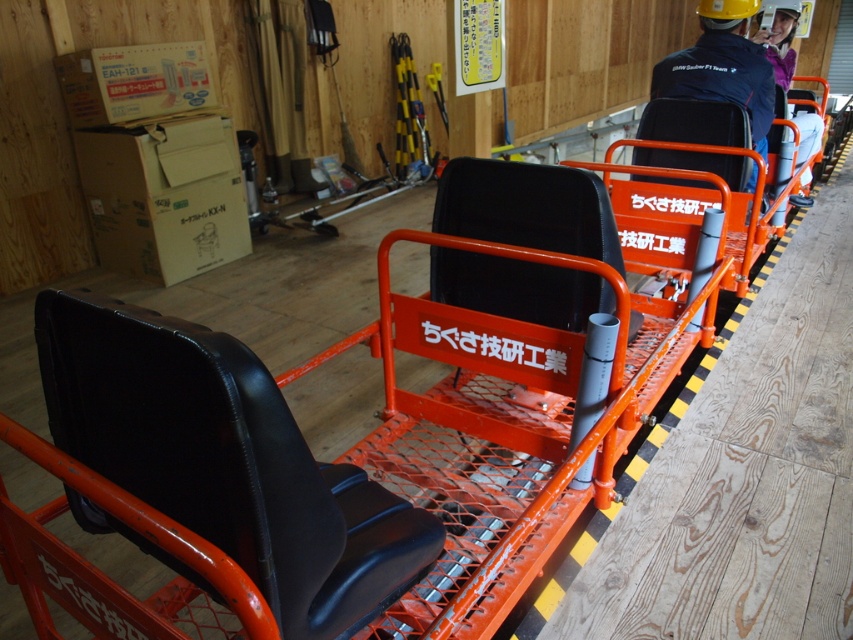
Based on the photo, who is positioned more to the left, black leather seat at center or purple fleece jacket at upper right?

black leather seat at center is more to the left.

The height and width of the screenshot is (640, 853). Find the location of `black leather seat at center`. black leather seat at center is located at coordinates (225, 460).

You are a GUI agent. You are given a task and a screenshot of the screen. Output one action in this format:
    pyautogui.click(x=<x>, y=<y>)
    Task: Click on the black leather seat at center
    Image resolution: width=853 pixels, height=640 pixels.
    Given the screenshot: What is the action you would take?
    pyautogui.click(x=225, y=460)

Identify the location of black leather jacket at upper right. (722, 67).

Can you confirm if black leather jacket at upper right is positioned to the left of purple fleece jacket at upper right?

Correct, you'll find black leather jacket at upper right to the left of purple fleece jacket at upper right.

Which is in front, point (733, 33) or point (788, 20)?

Point (733, 33)

In order to click on black leather jacket at upper right in this screenshot , I will do `click(722, 67)`.

Which of these two, black leather seat at center or black leather jacket at upper right, stands taller?

black leather jacket at upper right

Where is `black leather seat at center`? black leather seat at center is located at coordinates (225, 460).

This screenshot has width=853, height=640. In order to click on black leather seat at center in this screenshot , I will do `click(225, 460)`.